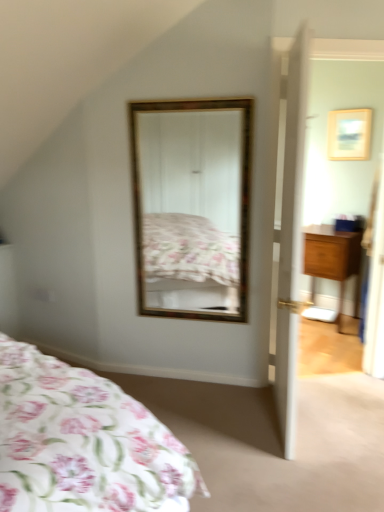
Question: Does wooden picture frame at upper right lie behind gold-framed mirror at center?

Choices:
 (A) yes
 (B) no

Answer: (A)

Question: Is wooden picture frame at upper right completely or partially outside of gold-framed mirror at center?

Choices:
 (A) yes
 (B) no

Answer: (A)

Question: Is wooden picture frame at upper right placed right next to gold-framed mirror at center?

Choices:
 (A) yes
 (B) no

Answer: (B)

Question: From the image's perspective, is wooden picture frame at upper right beneath gold-framed mirror at center?

Choices:
 (A) no
 (B) yes

Answer: (A)

Question: Does wooden picture frame at upper right have a greater width compared to gold-framed mirror at center?

Choices:
 (A) yes
 (B) no

Answer: (B)

Question: From a real-world perspective, does wooden picture frame at upper right stand above gold-framed mirror at center?

Choices:
 (A) yes
 (B) no

Answer: (A)

Question: Considering the relative positions of white wooden door at right and wooden nightstand at right in the image provided, is white wooden door at right in front of wooden nightstand at right?

Choices:
 (A) no
 (B) yes

Answer: (B)

Question: From the image's perspective, would you say white wooden door at right is shown under wooden nightstand at right?

Choices:
 (A) yes
 (B) no

Answer: (B)

Question: Is white wooden door at right smaller than wooden nightstand at right?

Choices:
 (A) yes
 (B) no

Answer: (B)

Question: Can you confirm if white wooden door at right is thinner than wooden nightstand at right?

Choices:
 (A) yes
 (B) no

Answer: (A)

Question: Is white wooden door at right located outside wooden nightstand at right?

Choices:
 (A) yes
 (B) no

Answer: (A)

Question: Is wooden nightstand at right a part of white wooden door at right?

Choices:
 (A) yes
 (B) no

Answer: (B)

Question: Can you confirm if wooden nightstand at right is shorter than gold-framed mirror at center?

Choices:
 (A) yes
 (B) no

Answer: (A)